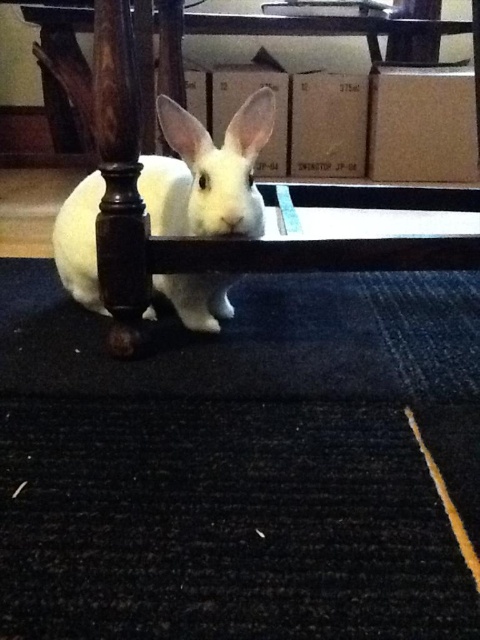
Measure the distance from black textured mat at lower center to white soft fur rabbit at center.

black textured mat at lower center and white soft fur rabbit at center are 8.46 inches apart.

Does black textured mat at lower center come behind white soft fur rabbit at center?

No, black textured mat at lower center is in front of white soft fur rabbit at center.

Identify the location of black textured mat at lower center. click(240, 464).